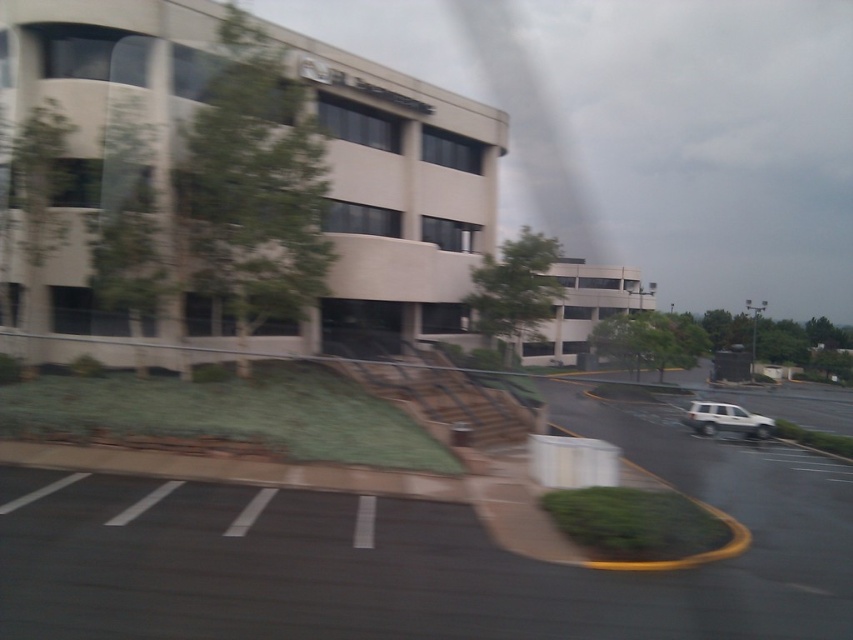
You are standing at the center of the image and want to walk to the black asphalt parking lot at lower left. In which direction should you move?

The black asphalt parking lot at lower left is located at point 0.870 on the x axis and 0.506 on the y axis. Since you are at the center, you need to move towards the lower left direction to reach it.

You are standing in the parking lot of the office complex and want to take a photo of the building. You notice two points marked in the scene. Which point, point (728, 492) or point (712, 412), is closer to you when you are facing the building?

Point (728, 492) is closer to the camera than point (712, 412), so it is closer to you when facing the building.

You are a delivery driver who needs to park your vehicle in the parking lot. The parking spot you want to use is marked by the point at coordinates (431, 556). Can you confirm if this parking spot is located on the black asphalt parking lot at lower left?

Yes, the point at coordinates (431, 556) corresponds to the black asphalt parking lot at lower left, so the parking spot is indeed located there.